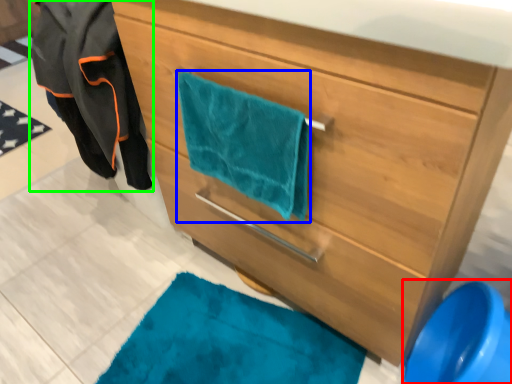
Question: Estimate the real-world distances between objects in this image. Which object is closer to teal (highlighted by a red box), beach towel (highlighted by a blue box) or jacket (highlighted by a green box)?

Choices:
 (A) beach towel
 (B) jacket

Answer: (A)